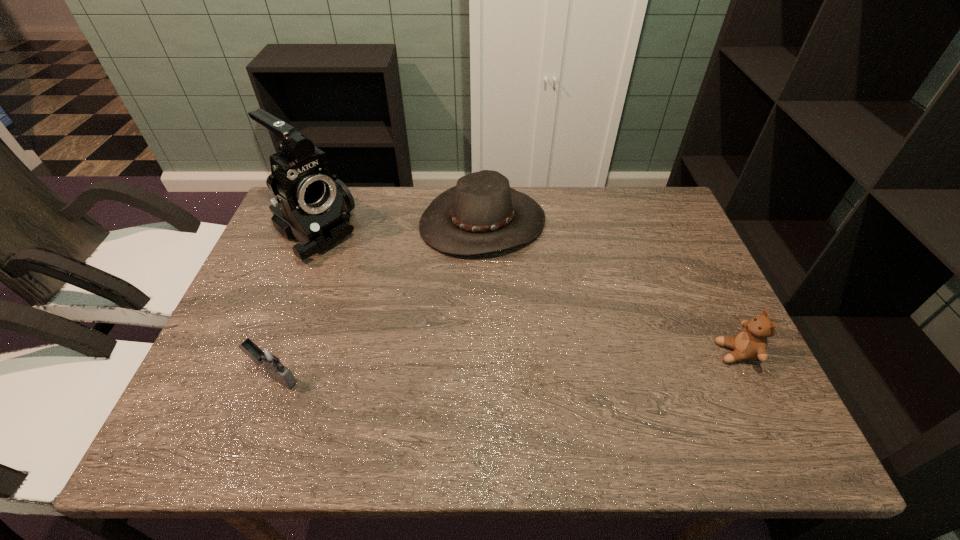
Locate an element on the screen. This screenshot has height=540, width=960. object present at the right edge is located at coordinates (751, 343).

The height and width of the screenshot is (540, 960). What are the coordinates of `object that is at the far left corner` in the screenshot? It's located at (312, 206).

Locate an element on the screen. Image resolution: width=960 pixels, height=540 pixels. object present at the near left corner is located at coordinates (267, 357).

This screenshot has width=960, height=540. Find the location of `object that is at the near right corner`. object that is at the near right corner is located at coordinates (751, 343).

In the image, there is a desktop. Identify the location of vacant space at the far edge. This screenshot has width=960, height=540. (540, 197).

You are a GUI agent. You are given a task and a screenshot of the screen. Output one action in this format:
    pyautogui.click(x=<x>, y=<y>)
    Task: Click on the vacant area at the near edge of the desktop
    The height and width of the screenshot is (540, 960).
    Given the screenshot: What is the action you would take?
    pyautogui.click(x=346, y=373)

Image resolution: width=960 pixels, height=540 pixels. Find the location of `vacant space at the left edge of the desktop`. vacant space at the left edge of the desktop is located at coordinates (269, 303).

Identify the location of free location at the right edge. (680, 297).

The width and height of the screenshot is (960, 540). I want to click on free space at the far right corner of the desktop, so click(684, 231).

You are a GUI agent. You are given a task and a screenshot of the screen. Output one action in this format:
    pyautogui.click(x=<x>, y=<y>)
    Task: Click on the vacant space at the near right corner of the desktop
    The height and width of the screenshot is (540, 960).
    Given the screenshot: What is the action you would take?
    pyautogui.click(x=733, y=375)